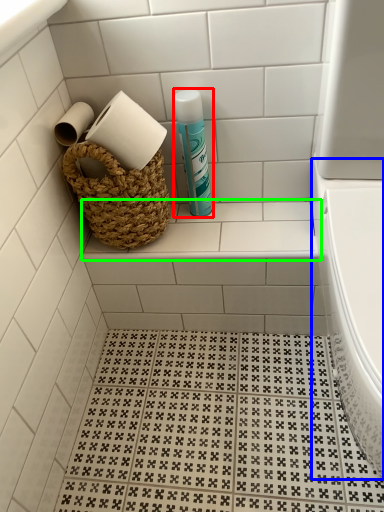
Question: Based on their relative distances, which object is nearer to cleaning product (highlighted by a red box)? Choose from bath (highlighted by a blue box) and ledge (highlighted by a green box).

Choices:
 (A) bath
 (B) ledge

Answer: (B)